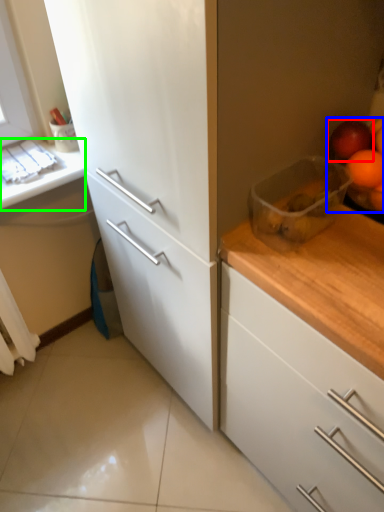
Question: Based on their relative distances, which object is farther from apple (highlighted by a red box)? Choose from fruit (highlighted by a blue box) and counter top (highlighted by a green box).

Choices:
 (A) fruit
 (B) counter top

Answer: (B)